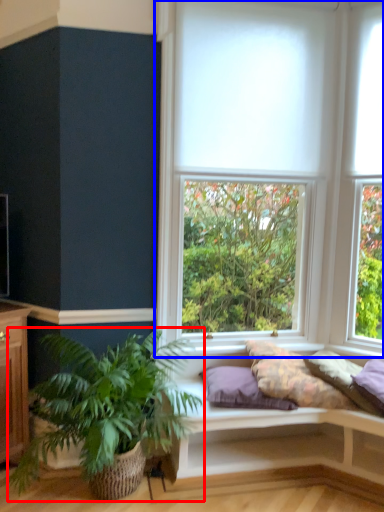
Question: Which object appears closest to the camera in this image, houseplant (highlighted by a red box) or window (highlighted by a blue box)?

Choices:
 (A) houseplant
 (B) window

Answer: (A)